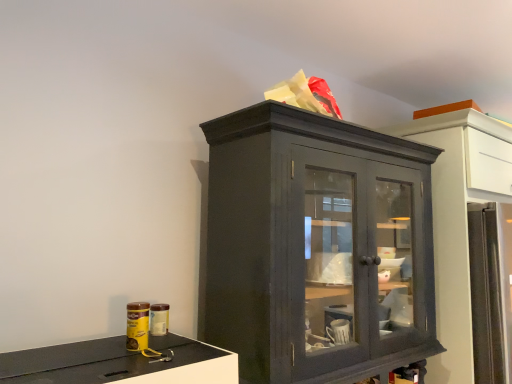
What do you see at coordinates (459, 219) in the screenshot? I see `matte gray cabinet at center` at bounding box center [459, 219].

Find the location of a particular element. matte gray cabinet at center is located at coordinates (459, 219).

Identify the location of matte gray cabinet at center. (459, 219).